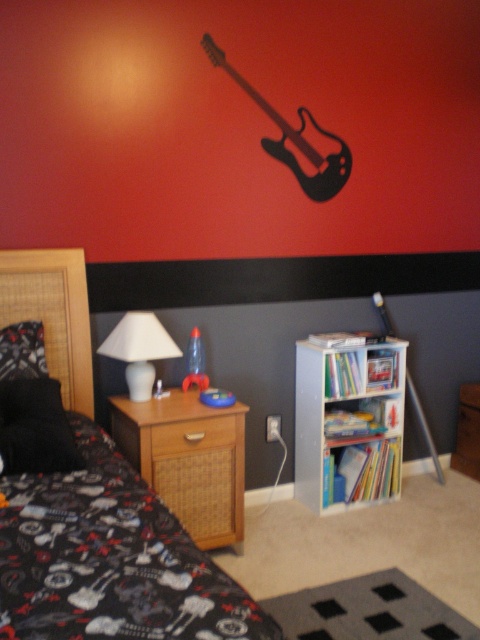
You are arranging a nightstand and a guitar in a bedroom. The woven wood nightstand at lower left and the black matte guitar at upper center need to be positioned according to the scene. Which object is closer to the left wall?

The woven wood nightstand at lower left is closer to the left wall because it is positioned to the left of the black matte guitar at upper center.

You are standing in the bedroom corner and want to place a 6 feet long ladder against the wall. The ladder needs to be placed near the woven wood nightstand at lower left. Is there enough space between you and the nightstand to place the ladder?

The distance of woven wood nightstand at lower left from viewer is 8.04 feet, so yes, there is enough space to place a 6 feet long ladder between you and the nightstand.